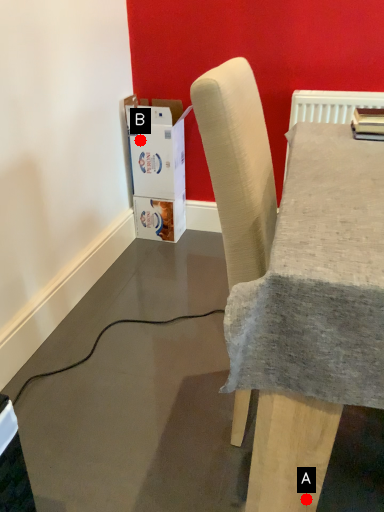
Question: Two points are circled on the image, labeled by A and B beside each circle. Which point is farther to the camera?

Choices:
 (A) A is further
 (B) B is further

Answer: (B)